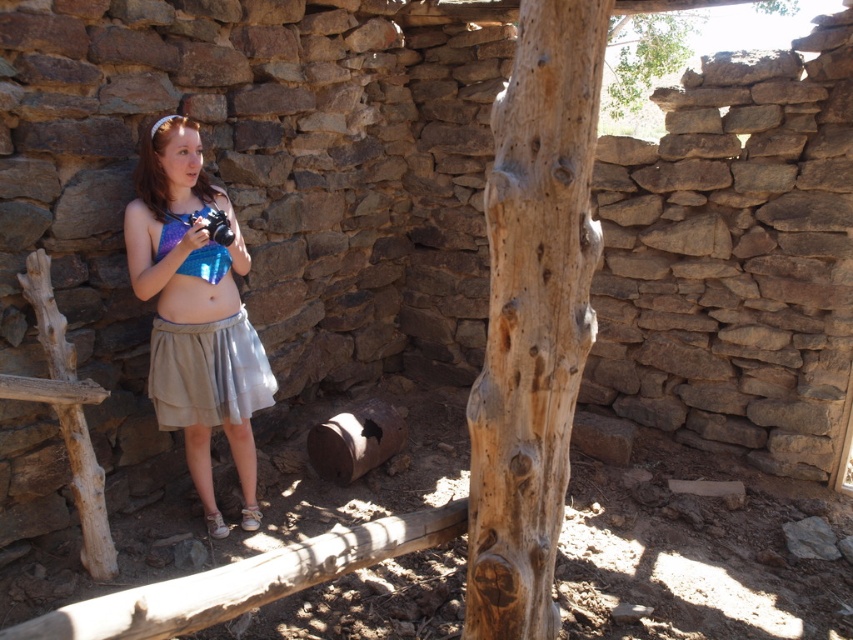
You are standing inside the rustic stone structure and notice two items of interest. You want to hang a small hook on the item that is taller. Which object should you choose between the rough wood tree at upper center and the shiny metallic bikini top at center?

The rough wood tree at upper center is taller than the shiny metallic bikini top at center, so you should hang the hook on the rough wood tree at upper center.